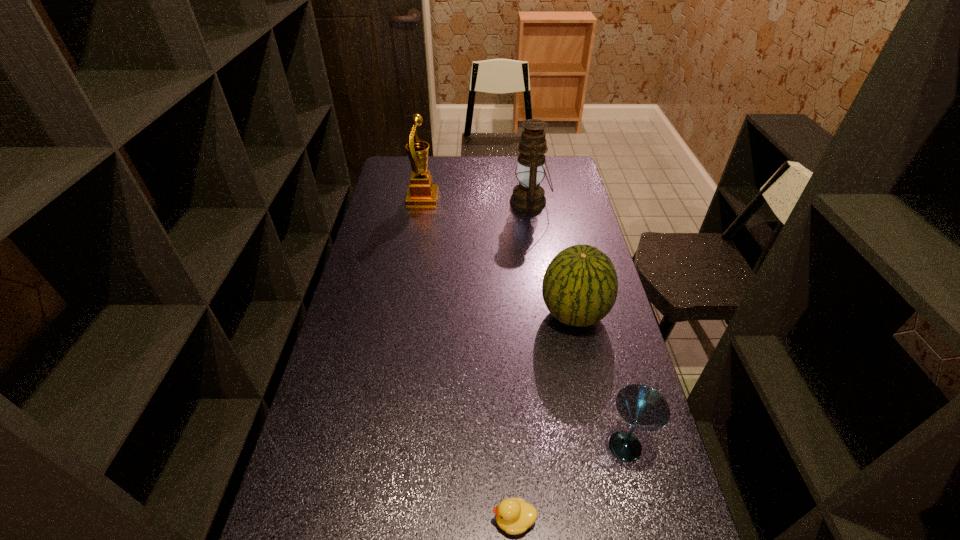
Locate an element on the screen. The width and height of the screenshot is (960, 540). free spot between the leftmost object and the martini is located at coordinates (524, 322).

Find the location of a particular element. object that is the second nearest to the award is located at coordinates (580, 285).

I want to click on object that is the closest to the second nearest object, so click(514, 516).

Locate an element on the screen. This screenshot has width=960, height=540. vacant space that satisfies the following two spatial constraints: 1. on the front-facing side of the leftmost object; 2. on the back side of the oil lamp is located at coordinates (422, 202).

The height and width of the screenshot is (540, 960). In order to click on vacant space that satisfies the following two spatial constraints: 1. on the front-facing side of the oil lamp; 2. on the right side of the leftmost object in this screenshot , I will do `click(422, 202)`.

Locate an element on the screen. vacant space that satisfies the following two spatial constraints: 1. on the back side of the watermelon; 2. on the front-facing side of the award is located at coordinates (549, 198).

Locate an element on the screen. This screenshot has width=960, height=540. free space that satisfies the following two spatial constraints: 1. on the front side of the watermelon; 2. on the right side of the fourth tallest object is located at coordinates (601, 446).

The height and width of the screenshot is (540, 960). I want to click on vacant region that satisfies the following two spatial constraints: 1. on the front side of the second nearest object; 2. on the left side of the oil lamp, so click(x=566, y=446).

Locate an element on the screen. vacant space that satisfies the following two spatial constraints: 1. on the front-facing side of the award; 2. on the right side of the second nearest object is located at coordinates (380, 446).

Image resolution: width=960 pixels, height=540 pixels. Find the location of `vacant space that satisfies the following two spatial constraints: 1. on the front-facing side of the award; 2. on the back side of the watermelon`. vacant space that satisfies the following two spatial constraints: 1. on the front-facing side of the award; 2. on the back side of the watermelon is located at coordinates (402, 314).